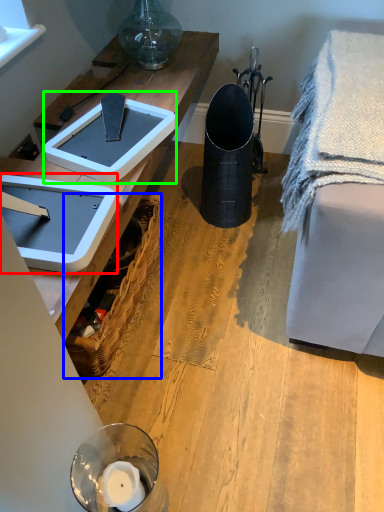
Question: Based on their relative distances, which object is farther from weight scale (highlighted by a red box)? Choose from picnic basket (highlighted by a blue box) and weight scale (highlighted by a green box).

Choices:
 (A) picnic basket
 (B) weight scale

Answer: (A)